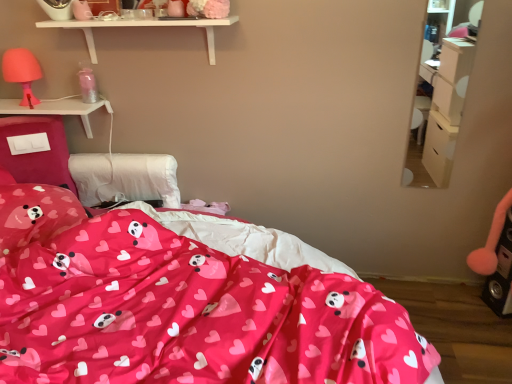
Question: From a real-world perspective, is white plastic switch at left positioned under matte pink pillow with heart and panda prints at lower left based on gravity?

Choices:
 (A) yes
 (B) no

Answer: (B)

Question: From the image's perspective, is white plastic switch at left located beneath matte pink pillow with heart and panda prints at lower left?

Choices:
 (A) no
 (B) yes

Answer: (A)

Question: Could you tell me if white plastic switch at left is turned towards matte pink pillow with heart and panda prints at lower left?

Choices:
 (A) yes
 (B) no

Answer: (B)

Question: Can you confirm if white plastic switch at left is bigger than matte pink pillow with heart and panda prints at lower left?

Choices:
 (A) no
 (B) yes

Answer: (A)

Question: Would you say white plastic switch at left is outside matte pink pillow with heart and panda prints at lower left?

Choices:
 (A) yes
 (B) no

Answer: (A)

Question: Would you say matte pink fabric bed at center is to the left or to the right of matte pink pillow with heart and panda prints at lower left in the picture?

Choices:
 (A) right
 (B) left

Answer: (A)

Question: From a real-world perspective, is matte pink fabric bed at center above or below matte pink pillow with heart and panda prints at lower left?

Choices:
 (A) above
 (B) below

Answer: (A)

Question: From their relative heights in the image, would you say matte pink fabric bed at center is taller or shorter than matte pink pillow with heart and panda prints at lower left?

Choices:
 (A) short
 (B) tall

Answer: (B)

Question: Based on their sizes in the image, would you say matte pink fabric bed at center is bigger or smaller than matte pink pillow with heart and panda prints at lower left?

Choices:
 (A) big
 (B) small

Answer: (A)

Question: From the image's perspective, relative to white matte shelf at upper center, is matte pink fabric bed at center above or below?

Choices:
 (A) below
 (B) above

Answer: (A)

Question: In terms of height, does matte pink fabric bed at center look taller or shorter compared to white matte shelf at upper center?

Choices:
 (A) short
 (B) tall

Answer: (B)

Question: Considering the positions of point (124, 241) and point (153, 21), is point (124, 241) closer or farther from the camera than point (153, 21)?

Choices:
 (A) closer
 (B) farther

Answer: (A)

Question: From a real-world perspective, is matte pink fabric bed at center above or below white matte shelf at upper center?

Choices:
 (A) below
 (B) above

Answer: (A)

Question: From a real-world perspective, relative to matte pink pillow with heart and panda prints at lower left, is matte pink lampshade at left vertically above or below?

Choices:
 (A) below
 (B) above

Answer: (B)

Question: In the image, is matte pink lampshade at left positioned in front of or behind matte pink pillow with heart and panda prints at lower left?

Choices:
 (A) behind
 (B) front

Answer: (A)